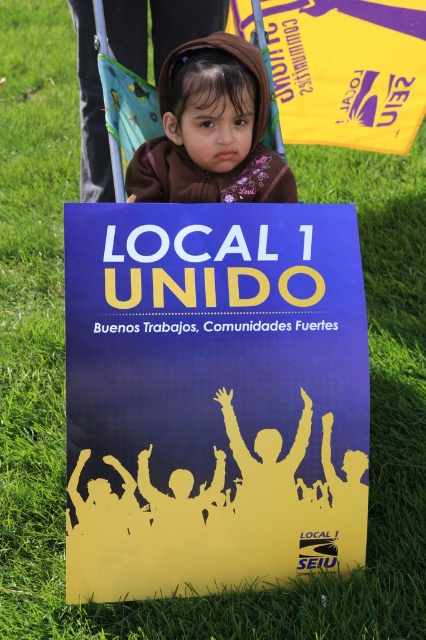
Based on the photo, you are a delivery person trying to find the address of the child in the image. You see the blue paper poster at center and the brown fleece jacket at upper center. Which object is wider?

The blue paper poster at center might be wider than brown fleece jacket at upper center.

You are a photographer standing in front of the blue paper poster at center. You want to take a photo of the child sitting behind it. Since the poster is blocking your view, where should you move to get a clear shot of the child?

Move to the left or right of the blue paper poster at center to get a clear shot of the child sitting behind it.

You are a photographer trying to capture a clear shot of the child in the scene. The blue paper poster at center and brown fleece jacket at upper center are blocking your view. Which object should you move to get a better view of the child?

The blue paper poster at center is taller than the brown fleece jacket at upper center. To get a better view of the child, you should move the blue paper poster at center first since it is taller and more obstructive.